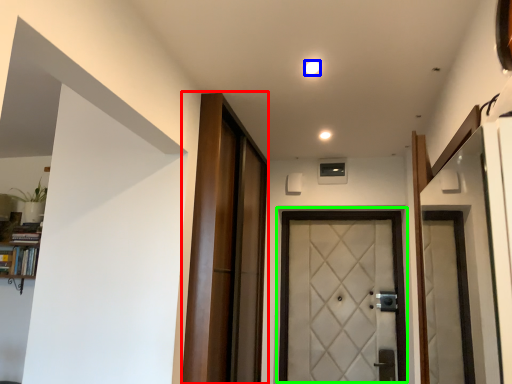
Question: Which is farther away from barn door (highlighted by a red box)? light (highlighted by a blue box) or door (highlighted by a green box)?

Choices:
 (A) light
 (B) door

Answer: (A)